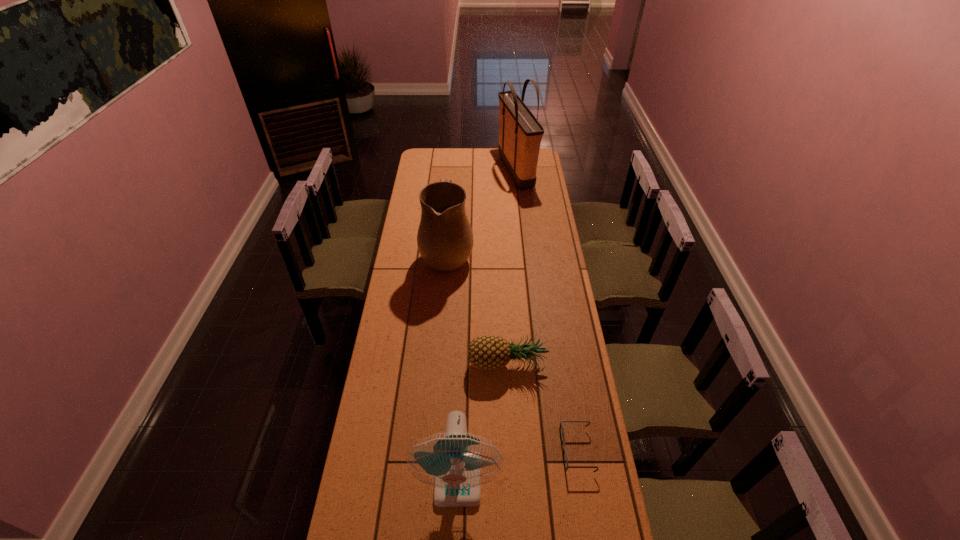
What are the coordinates of `empty space between the shopping bag and the fourth nearest object` in the screenshot? It's located at pos(482,212).

You are a GUI agent. You are given a task and a screenshot of the screen. Output one action in this format:
    pyautogui.click(x=<x>, y=<y>)
    Task: Click on the object that is the fourth closest to the shortest object
    This screenshot has width=960, height=540.
    Given the screenshot: What is the action you would take?
    pyautogui.click(x=520, y=134)

Point out which object is positioned as the nearest to the shopping bag. Please provide its 2D coordinates. Your answer should be formatted as a tuple, i.e. [(x, y)], where the tuple contains the x and y coordinates of a point satisfying the conditions above.

[(445, 241)]

The image size is (960, 540). What are the coordinates of `vacant space that satisfies the following two spatial constraints: 1. on the back side of the third farthest object; 2. at the spout of the cream pitcher` in the screenshot? It's located at (501, 254).

Locate an element on the screen. The height and width of the screenshot is (540, 960). free region that satisfies the following two spatial constraints: 1. on the back side of the farthest object; 2. on the left side of the pineapple is located at coordinates (497, 171).

You are a GUI agent. You are given a task and a screenshot of the screen. Output one action in this format:
    pyautogui.click(x=<x>, y=<y>)
    Task: Click on the blank space that satisfies the following two spatial constraints: 1. on the front side of the tallest object; 2. at the spout of the cream pitcher
    Image resolution: width=960 pixels, height=540 pixels.
    Given the screenshot: What is the action you would take?
    pyautogui.click(x=525, y=254)